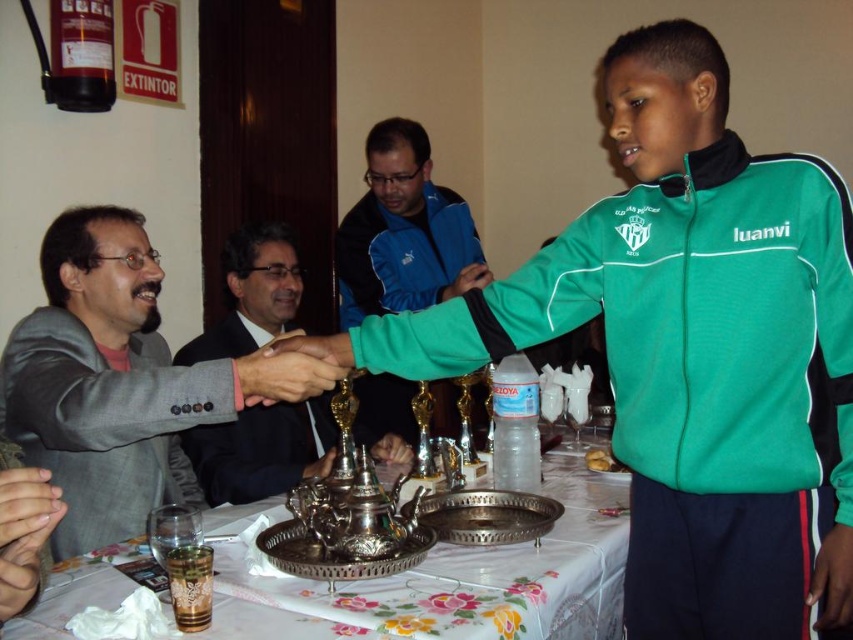
Is silver metallic tray at center taller than green fabric hand at center?

Yes, silver metallic tray at center is taller than green fabric hand at center.

Who is shorter, silver metallic tray at center or green fabric hand at center?

green fabric hand at center is shorter.

Image resolution: width=853 pixels, height=640 pixels. In order to click on silver metallic tray at center in this screenshot , I will do `click(447, 577)`.

This screenshot has height=640, width=853. I want to click on metallic gold trophy at center, so click(x=287, y=371).

Between point (262, 392) and point (381, 448), which one is positioned in front?

Point (262, 392) is more forward.

At what (x,y) coordinates should I click in order to perform the action: click on metallic gold trophy at center. Please return your answer as a coordinate pair (x, y). This screenshot has height=640, width=853. Looking at the image, I should click on (287, 371).

Between shiny black suit at center and metallic gold trophy at center, which one has more height?

shiny black suit at center

Is shiny black suit at center positioned at the back of metallic gold trophy at center?

Yes, shiny black suit at center is behind metallic gold trophy at center.

Is point (196, 440) in front of point (329, 384)?

No.

Identify the location of shiny black suit at center. The image size is (853, 640). (260, 451).